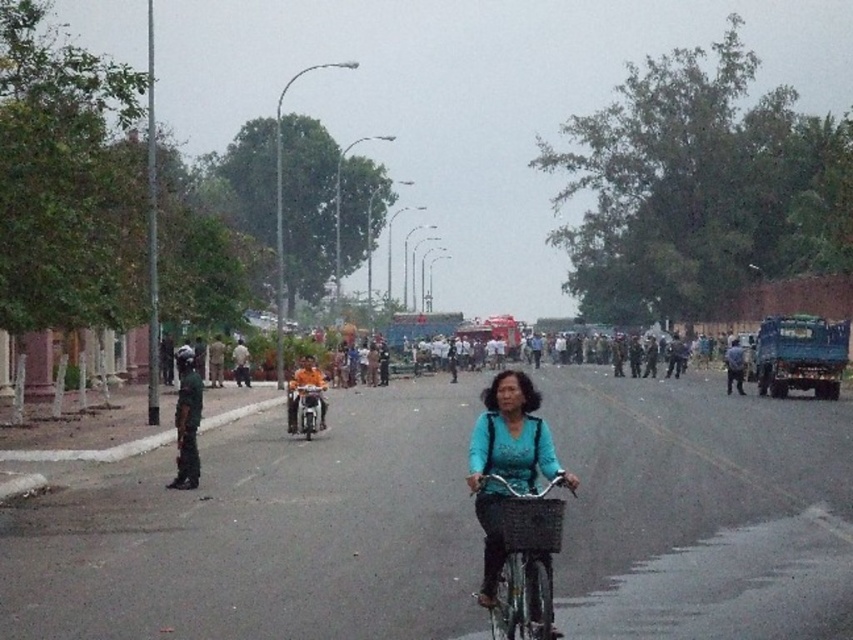
Question: Which point is closer to the camera?

Choices:
 (A) dark green uniform at left
 (B) metallic silver bicycle at center

Answer: (B)

Question: Based on their relative distances, which object is farther from the dark green uniform at left?

Choices:
 (A) metallic silver motorcycle at center
 (B) metallic silver bicycle at center

Answer: (B)

Question: Is dark green uniform at left below metallic silver motorcycle at center?

Choices:
 (A) yes
 (B) no

Answer: (B)

Question: Where is dark green uniform at left located in relation to metallic silver motorcycle at center in the image?

Choices:
 (A) above
 (B) below

Answer: (A)

Question: Which point appears closest to the camera in this image?

Choices:
 (A) (521, 580)
 (B) (305, 426)
 (C) (177, 358)

Answer: (A)

Question: Can you confirm if metallic silver bicycle at center is bigger than dark green uniform at left?

Choices:
 (A) yes
 (B) no

Answer: (B)